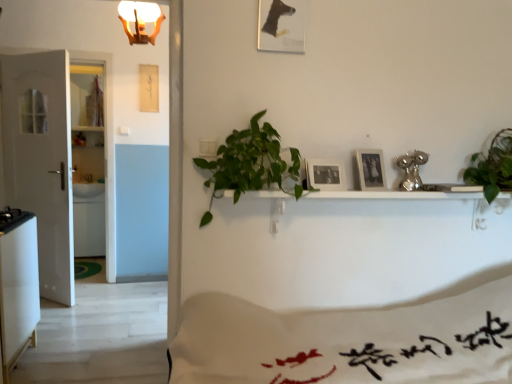
The height and width of the screenshot is (384, 512). Find the location of `vacant space behind white glossy refrigerator at lower left`. vacant space behind white glossy refrigerator at lower left is located at coordinates (60, 339).